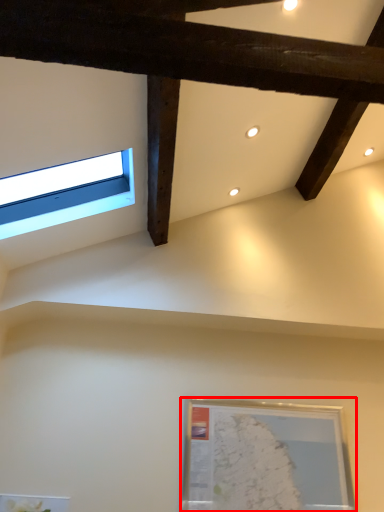
Question: From the image's perspective, what is the correct spatial relationship of picture frame (annotated by the red box) in relation to window?

Choices:
 (A) below
 (B) above

Answer: (A)